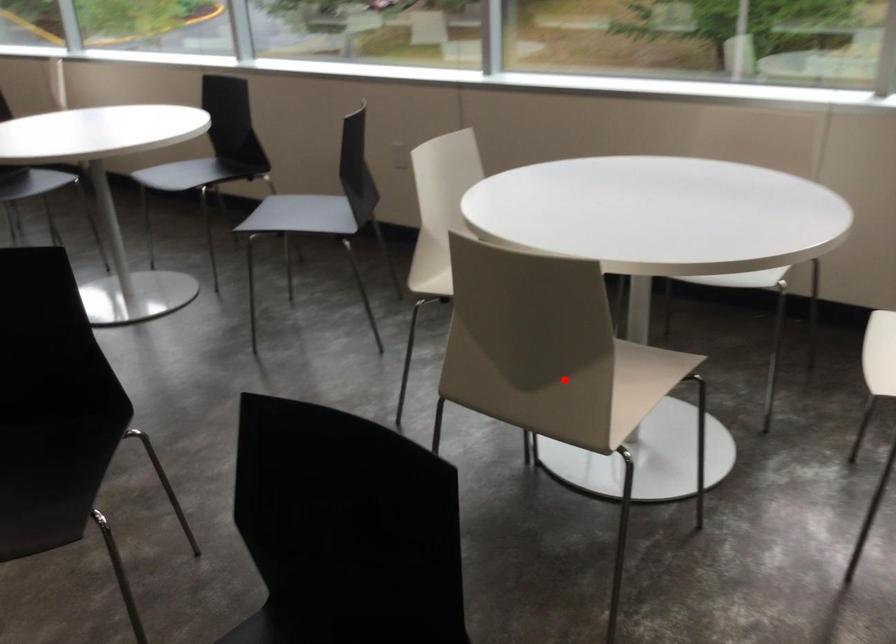
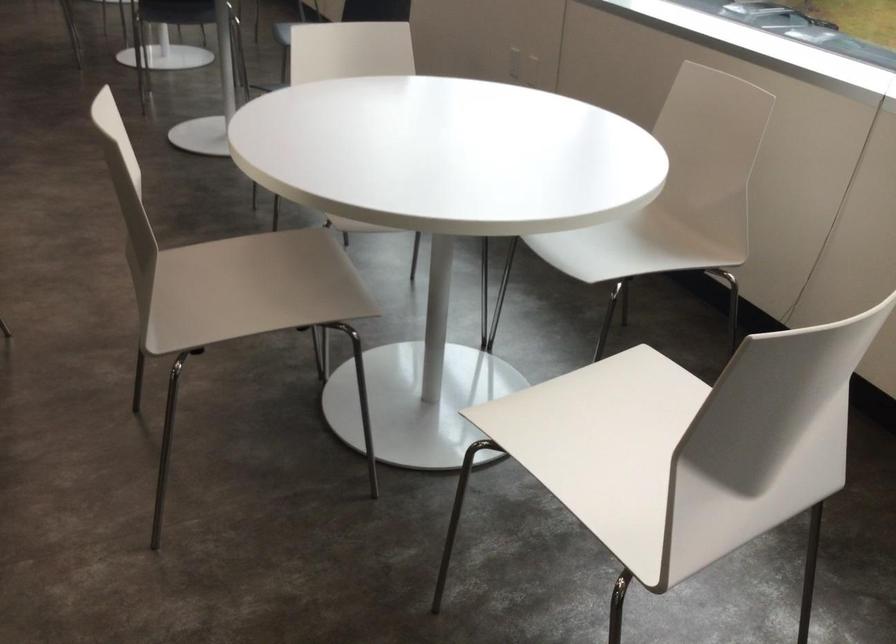
Locate, in the second image, the point that corresponds to the highlighted location in the first image.

(252, 288)